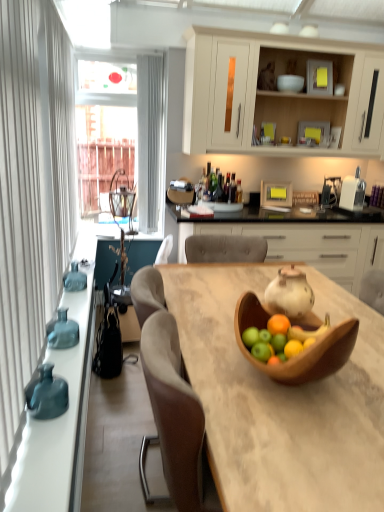
Where is `space that is in front of wooden bowl at center`? The width and height of the screenshot is (384, 512). space that is in front of wooden bowl at center is located at coordinates (306, 442).